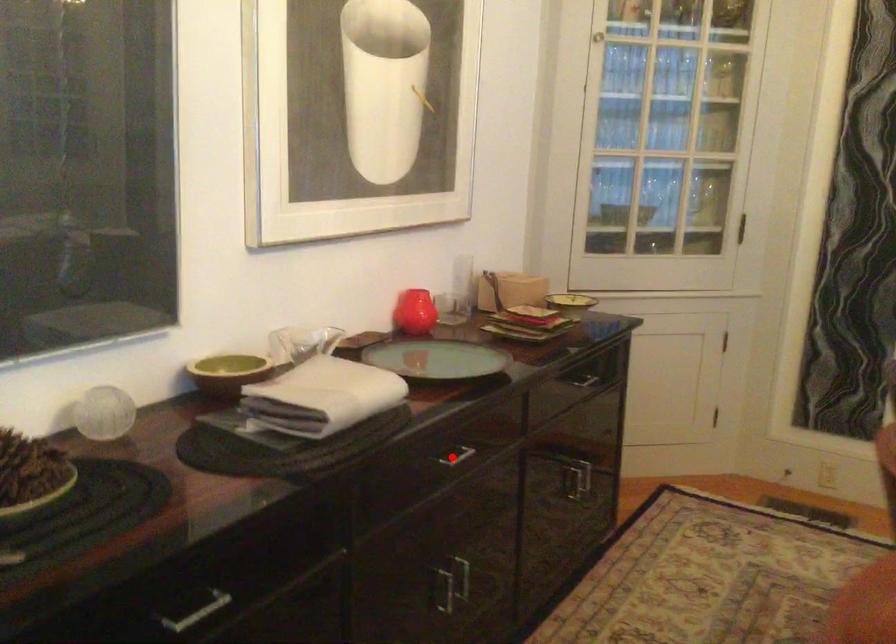
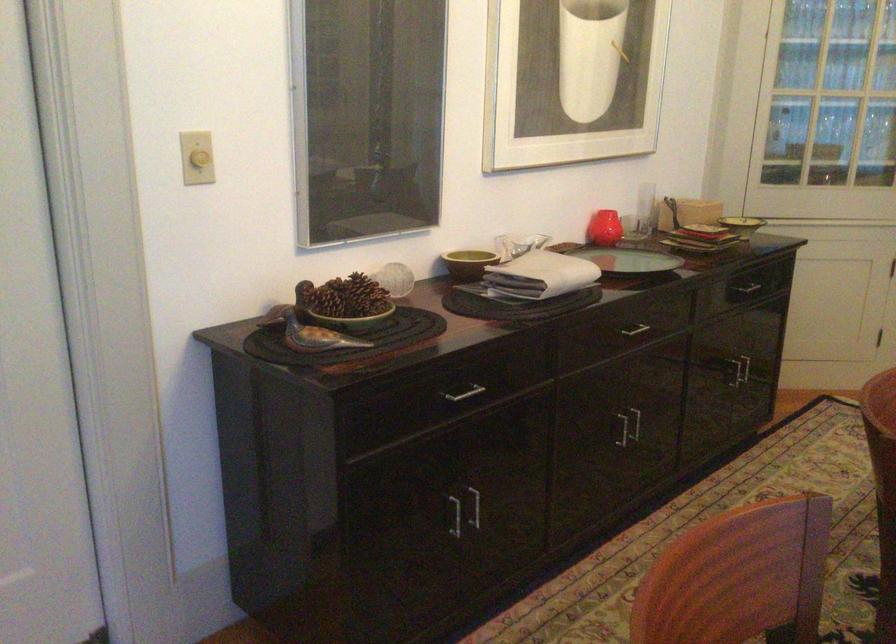
Question: A red point is marked in image1. In image2, is the corresponding 3D point closer to the camera or farther? Reply with the corresponding letter.

Choices:
 (A) The corresponding 3D point is closer.
 (B) The corresponding 3D point is farther.

Answer: (B)